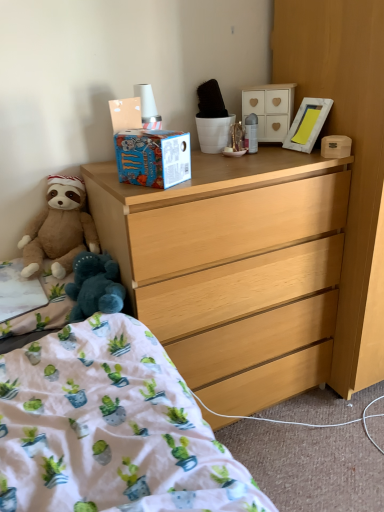
You are a GUI agent. You are given a task and a screenshot of the screen. Output one action in this format:
    pyautogui.click(x=<x>, y=<y>)
    Task: Click on the vacant space situated on the left part of white wooden picture frame at upper right
    
    Given the screenshot: What is the action you would take?
    pyautogui.click(x=269, y=154)